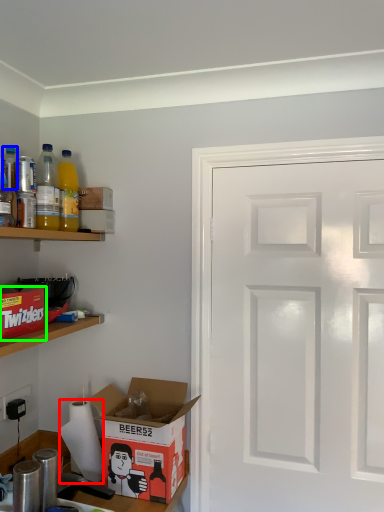
Question: Which is farther away from paper towel (highlighted by a red box)? bottle (highlighted by a blue box) or cardboard box (highlighted by a green box)?

Choices:
 (A) bottle
 (B) cardboard box

Answer: (A)